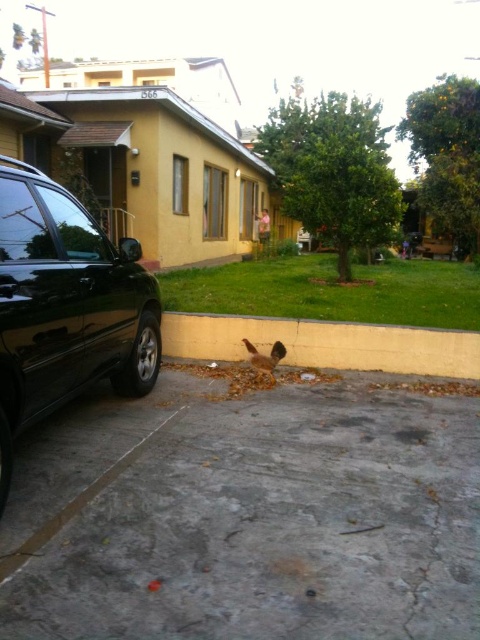
Question: In this image, where is black glossy suv at left located relative to yellow concrete curb at lower center?

Choices:
 (A) above
 (B) below

Answer: (A)

Question: Which of the following is the farthest from the observer?

Choices:
 (A) brown feathered bird at lower center
 (B) gray concrete pavement at lower center

Answer: (A)

Question: Which object is closer to the camera taking this photo?

Choices:
 (A) yellow concrete curb at lower center
 (B) gray concrete pavement at lower center

Answer: (B)

Question: Does black glossy suv at left appear on the right side of brown feathered bird at lower center?

Choices:
 (A) no
 (B) yes

Answer: (A)

Question: Is yellow concrete curb at lower center positioned at the back of brown feathered bird at lower center?

Choices:
 (A) yes
 (B) no

Answer: (A)

Question: Based on their relative distances, which object is farther from the black glossy suv at left?

Choices:
 (A) yellow concrete curb at lower center
 (B) gray concrete pavement at lower center

Answer: (A)